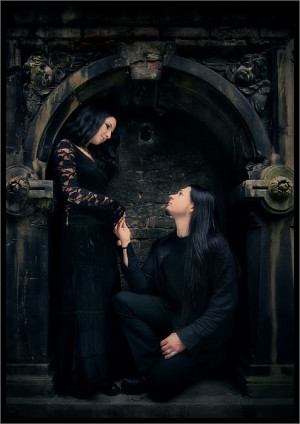
I want to click on wings on angel sculpture, so click(x=259, y=101), click(x=223, y=67), click(x=61, y=66), click(x=28, y=90).